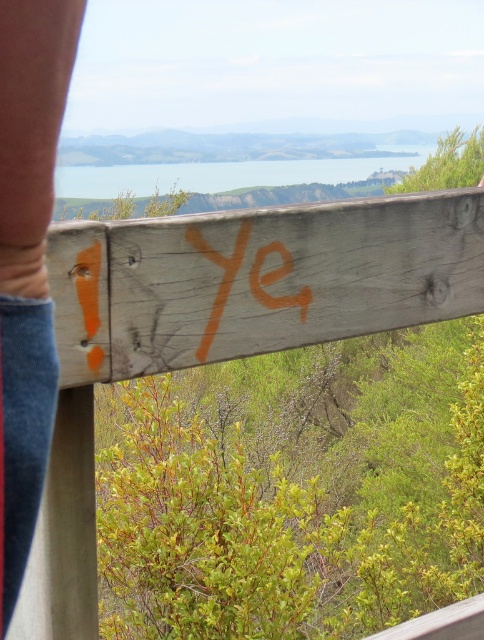
You are a photographer trying to capture the scenic coastal view. You notice the smooth skin arm at upper left in your frame. Based on its position, where would you adjust your camera to exclude the arm from the photo?

Since the smooth skin arm at upper left is located at point (28, 260), you should adjust your camera downward and to the right to exclude it from the frame.

You are a photographer trying to capture the orange painted lettering at center while avoiding the smooth skin arm at upper left in your shot. Based on their positions, can you adjust your camera angle to exclude the arm?

The smooth skin arm at upper left is to the left of the orange painted lettering at center, so you can move your camera slightly to the right to exclude the arm while keeping the lettering in frame.

You are a photographer trying to capture the scenic view from the railing. There is a point at coordinates (28, 260) which marks the smooth skin arm at upper left. To avoid the arm blocking the view, where should you position yourself relative to that point?

The point at (28, 260) marks the smooth skin arm at upper left. To avoid the arm blocking the view, you should position yourself to the right of that point.